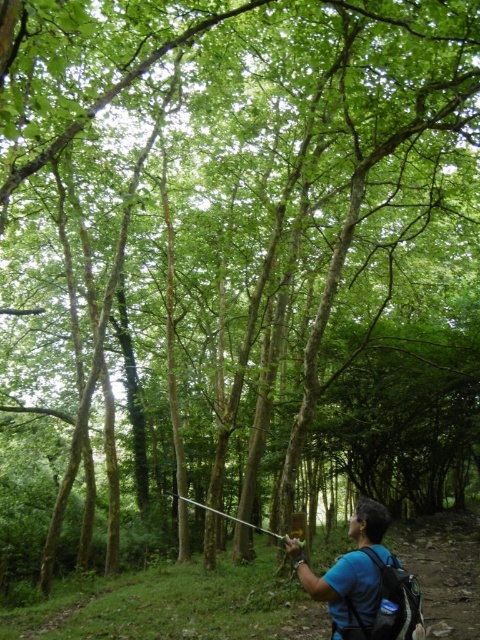
Which is more to the right, blue fabric backpack at lower right or metallic silver fishing pole at center?

blue fabric backpack at lower right

Does blue fabric backpack at lower right have a greater width compared to metallic silver fishing pole at center?

In fact, blue fabric backpack at lower right might be narrower than metallic silver fishing pole at center.

Does point (355, 513) lie in front of point (245, 522)?

Yes.

Find the location of a particular element. blue fabric backpack at lower right is located at coordinates (362, 580).